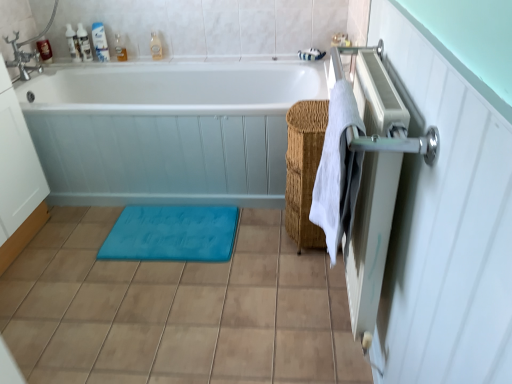
At what (x,y) coordinates should I click in order to perform the action: click on free space above brown matte tile at lower center (from a real-world perspective). Please return your answer as a coordinate pair (x, y). Looking at the image, I should click on (178, 290).